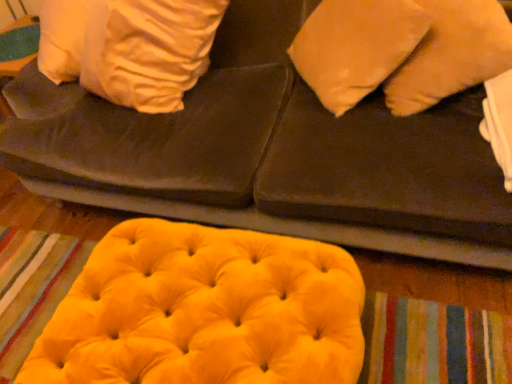
This screenshot has width=512, height=384. Identify the location of velvet yellow ottoman at lower center. (271, 153).

Where is `matte orange pillow at upper right`? The width and height of the screenshot is (512, 384). matte orange pillow at upper right is located at coordinates pyautogui.click(x=355, y=47).

This screenshot has height=384, width=512. In order to click on velvet yellow bean bag at lower center in this screenshot , I will do `click(204, 311)`.

Is velvet yellow ottoman at lower center oriented towards velvet yellow bean bag at lower center?

Yes, velvet yellow ottoman at lower center is oriented towards velvet yellow bean bag at lower center.

Who is bigger, velvet yellow ottoman at lower center or velvet yellow bean bag at lower center?

velvet yellow ottoman at lower center.

In terms of width, does velvet yellow ottoman at lower center look wider or thinner when compared to velvet yellow bean bag at lower center?

Clearly, velvet yellow ottoman at lower center has more width compared to velvet yellow bean bag at lower center.

Is velvet yellow bean bag at lower center in front of velvet yellow ottoman at lower center?

No, it is not.

Is point (236, 375) positioned after point (472, 136)?

No, (236, 375) is in front of (472, 136).

Who is taller, velvet yellow bean bag at lower center or velvet yellow ottoman at lower center?

With more height is velvet yellow ottoman at lower center.

At what (x,y) coordinates should I click in order to perform the action: click on bean bag chair below the velvet yellow ottoman at lower center (from a real-world perspective). Please return your answer as a coordinate pair (x, y). Image resolution: width=512 pixels, height=384 pixels. Looking at the image, I should click on (204, 311).

Is velvet yellow ottoman at lower center positioned far away from matte orange pillow at upper right?

Actually, velvet yellow ottoman at lower center and matte orange pillow at upper right are a little close together.

Is point (226, 194) in front of point (407, 56)?

No, it is behind (407, 56).

Can you confirm if velvet yellow ottoman at lower center is positioned to the left of matte orange pillow at upper right?

Yes, velvet yellow ottoman at lower center is to the left of matte orange pillow at upper right.

Is velvet yellow ottoman at lower center in front of matte orange pillow at upper right?

That is True.

From the image's perspective, between velvet yellow bean bag at lower center and matte orange pillow at upper right, who is located below?

velvet yellow bean bag at lower center appears lower in the image.

From a real-world perspective, is velvet yellow bean bag at lower center above or below matte orange pillow at upper right?

velvet yellow bean bag at lower center is situated lower than matte orange pillow at upper right in the real world.

Considering the sizes of objects velvet yellow bean bag at lower center and matte orange pillow at upper right in the image provided, who is taller, velvet yellow bean bag at lower center or matte orange pillow at upper right?

Standing taller between the two is matte orange pillow at upper right.

Considering the positions of points (112, 228) and (326, 96), is point (112, 228) closer to camera compared to point (326, 96)?

No, (112, 228) is further to viewer.

Can we say matte orange pillow at upper right lies outside velvet yellow bean bag at lower center?

matte orange pillow at upper right lies outside velvet yellow bean bag at lower center's area.

From a real-world perspective, does matte orange pillow at upper right sit lower than velvet yellow bean bag at lower center?

Actually, matte orange pillow at upper right is physically above velvet yellow bean bag at lower center in the real world.

Considering the positions of points (351, 13) and (300, 246), is point (351, 13) closer to camera compared to point (300, 246)?

That is False.

Which of these two, matte orange pillow at upper right or velvet yellow ottoman at lower center, is wider?

With larger width is velvet yellow ottoman at lower center.

From the image's perspective, is matte orange pillow at upper right located above or below velvet yellow ottoman at lower center?

Based on their image positions, matte orange pillow at upper right is located above velvet yellow ottoman at lower center.

Is velvet yellow ottoman at lower center inside matte orange pillow at upper right?

No, velvet yellow ottoman at lower center is not surrounded by matte orange pillow at upper right.

Looking at this image, from a real-world perspective, does matte orange pillow at upper right stand above velvet yellow ottoman at lower center?

Yes, from a real-world perspective, matte orange pillow at upper right is above velvet yellow ottoman at lower center.

Find the location of `bean bag chair on the left of velvet yellow ottoman at lower center`. bean bag chair on the left of velvet yellow ottoman at lower center is located at coordinates (204, 311).

You are a GUI agent. You are given a task and a screenshot of the screen. Output one action in this format:
    pyautogui.click(x=<x>, y=<y>)
    Task: Click on the bean bag chair lying behind the velvet yellow ottoman at lower center
    
    Given the screenshot: What is the action you would take?
    pyautogui.click(x=204, y=311)

Considering their positions, is velvet yellow ottoman at lower center positioned closer to matte orange pillow at upper right than velvet yellow bean bag at lower center?

velvet yellow ottoman at lower center.

Looking at the image, which one is located closer to velvet yellow bean bag at lower center, matte orange pillow at upper right or velvet yellow ottoman at lower center?

velvet yellow ottoman at lower center is closer to velvet yellow bean bag at lower center.

Which object lies further to the anchor point velvet yellow ottoman at lower center, matte orange pillow at upper right or velvet yellow bean bag at lower center?

Among the two, velvet yellow bean bag at lower center is located further to velvet yellow ottoman at lower center.

Looking at the image, which one is located closer to velvet yellow ottoman at lower center, velvet yellow bean bag at lower center or matte orange pillow at upper right?

matte orange pillow at upper right is closer to velvet yellow ottoman at lower center.

From the image, which object appears to be farther from velvet yellow bean bag at lower center, velvet yellow ottoman at lower center or matte orange pillow at upper right?

The object further to velvet yellow bean bag at lower center is matte orange pillow at upper right.

From the picture: Considering their positions, is velvet yellow bean bag at lower center positioned closer to matte orange pillow at upper right than velvet yellow ottoman at lower center?

Based on the image, velvet yellow ottoman at lower center appears to be nearer to matte orange pillow at upper right.

The image size is (512, 384). In order to click on furniture between matte orange pillow at upper right and velvet yellow bean bag at lower center in the vertical direction in this screenshot , I will do `click(271, 153)`.